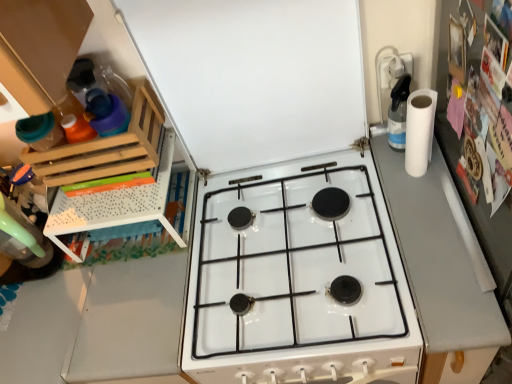
Question: In the image, is gray matte counter top at right positioned in front of or behind white glossy gas stove at center?

Choices:
 (A) front
 (B) behind

Answer: (A)

Question: Is gray matte counter top at right spatially inside white glossy gas stove at center, or outside of it?

Choices:
 (A) inside
 (B) outside

Answer: (B)

Question: Estimate the real-world distances between objects in this image. Which object is closer to the wooden rack at left?

Choices:
 (A) white matte exhaust hood at upper center
 (B) gray matte counter top at right
 (C) white matte paper towel at right
 (D) white glossy gas stove at center
 (E) clear plastic spray bottle at upper right

Answer: (A)

Question: Which is nearer to the white matte paper towel at right?

Choices:
 (A) wooden rack at left
 (B) white matte exhaust hood at upper center
 (C) white glossy gas stove at center
 (D) gray matte counter top at right
 (E) clear plastic spray bottle at upper right

Answer: (E)